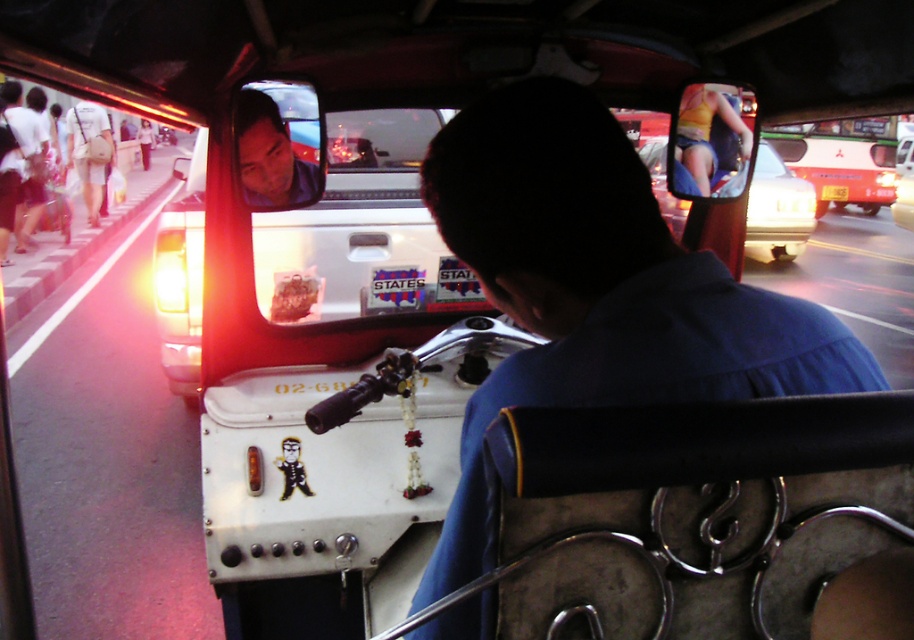
Between point (83, 170) and point (144, 136), which one is positioned behind?

The point (144, 136) is more distant.

Between white fabric bag at left and light brown skin at center, which one appears on the right side from the viewer's perspective?

From the viewer's perspective, white fabric bag at left appears more on the right side.

Which is behind, point (99, 179) or point (146, 147)?

The point (146, 147) is behind.

The image size is (914, 640). Find the location of `white fabric bag at left`. white fabric bag at left is located at coordinates click(89, 152).

Is the position of yellow fabric bikini at upper right more distant than that of white fabric bag at left?

No.

Consider the image. Can you confirm if yellow fabric bikini at upper right is smaller than white fabric bag at left?

Yes.

This screenshot has width=914, height=640. I want to click on yellow fabric bikini at upper right, so click(710, 141).

The width and height of the screenshot is (914, 640). What do you see at coordinates (278, 144) in the screenshot?
I see `matte plastic face at upper center` at bounding box center [278, 144].

Where is `matte plastic face at upper center`? Image resolution: width=914 pixels, height=640 pixels. matte plastic face at upper center is located at coordinates (278, 144).

Is point (274, 93) closer to viewer compared to point (721, 163)?

Yes, point (274, 93) is in front of point (721, 163).

I want to click on matte plastic face at upper center, so click(278, 144).